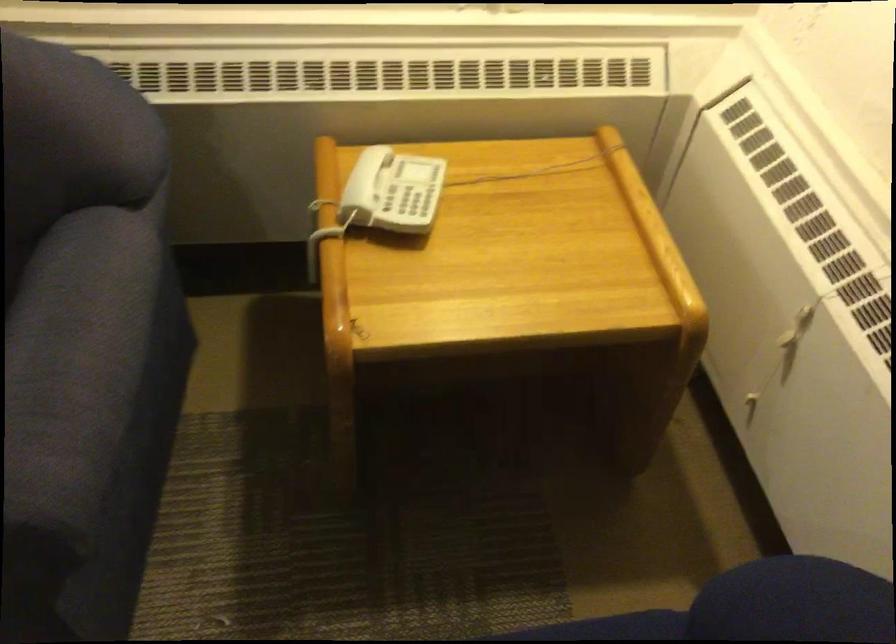
This screenshot has width=896, height=644. In order to click on white telephone handset in this screenshot , I will do `click(364, 185)`.